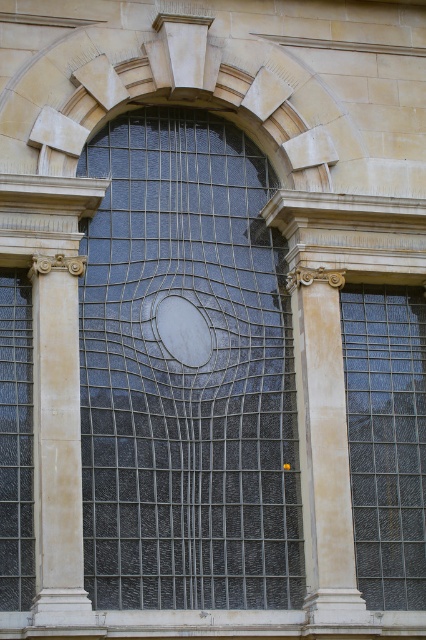
Can you confirm if smooth stone pillar at right is shorter than clear glass window at left?

In fact, smooth stone pillar at right may be taller than clear glass window at left.

Is point (351, 525) closer to camera compared to point (17, 394)?

No, it is not.

Locate an element on the screen. Image resolution: width=426 pixels, height=640 pixels. smooth stone pillar at right is located at coordinates (324, 449).

Who is taller, clear textured glass at right or smooth stone pillar at right?

With more height is smooth stone pillar at right.

Is clear textured glass at right above smooth stone pillar at right?

Correct, clear textured glass at right is located above smooth stone pillar at right.

Which is behind, point (411, 433) or point (325, 570)?

The point (411, 433) is behind.

Where is `clear textured glass at right`? The width and height of the screenshot is (426, 640). clear textured glass at right is located at coordinates (385, 440).

Can you confirm if clear textured glass at right is taller than clear glass window at left?

Yes.

Can you confirm if clear textured glass at right is thinner than clear glass window at left?

No, clear textured glass at right is not thinner than clear glass window at left.

Image resolution: width=426 pixels, height=640 pixels. Find the location of `clear textured glass at right`. clear textured glass at right is located at coordinates (385, 440).

Identify the location of clear textured glass at right. (385, 440).